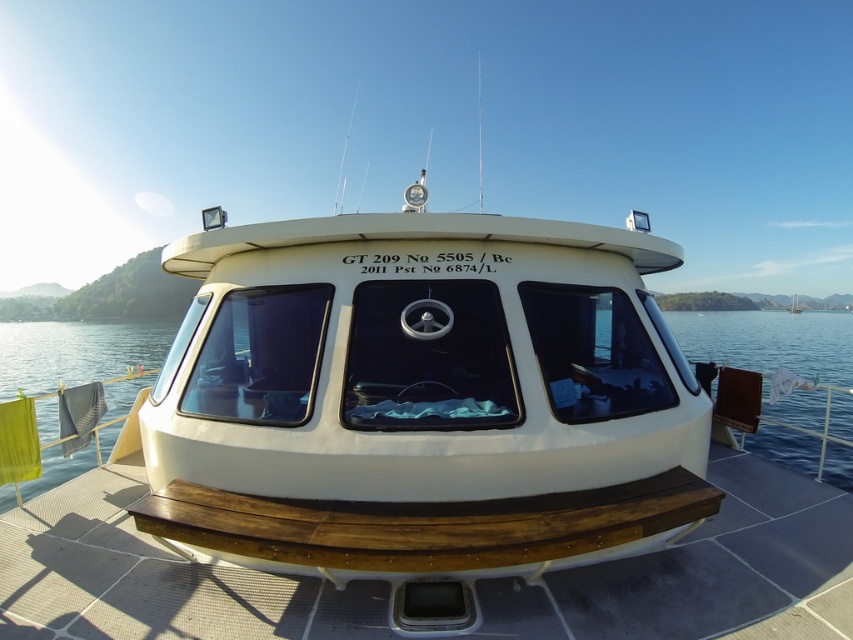
Measure the distance between point (548, 609) and camera.

They are 8.12 feet apart.

Which of these two, brown wood at center or transparent glass water at center, stands taller?

transparent glass water at center

The width and height of the screenshot is (853, 640). In order to click on brown wood at center in this screenshot , I will do `click(704, 572)`.

Find the location of a particular element. The height and width of the screenshot is (640, 853). brown wood at center is located at coordinates (704, 572).